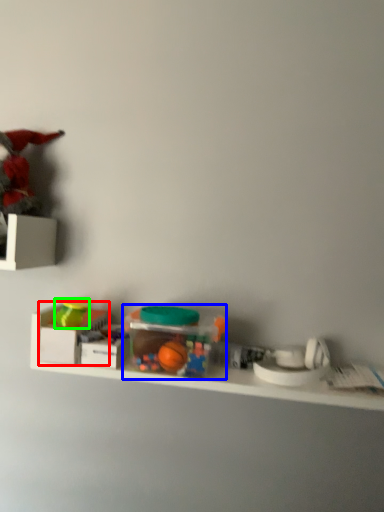
Question: Based on their relative distances, which object is farther from storage box (highlighted by a red box)? Choose from toy (highlighted by a blue box) and toy (highlighted by a green box).

Choices:
 (A) toy
 (B) toy

Answer: (A)